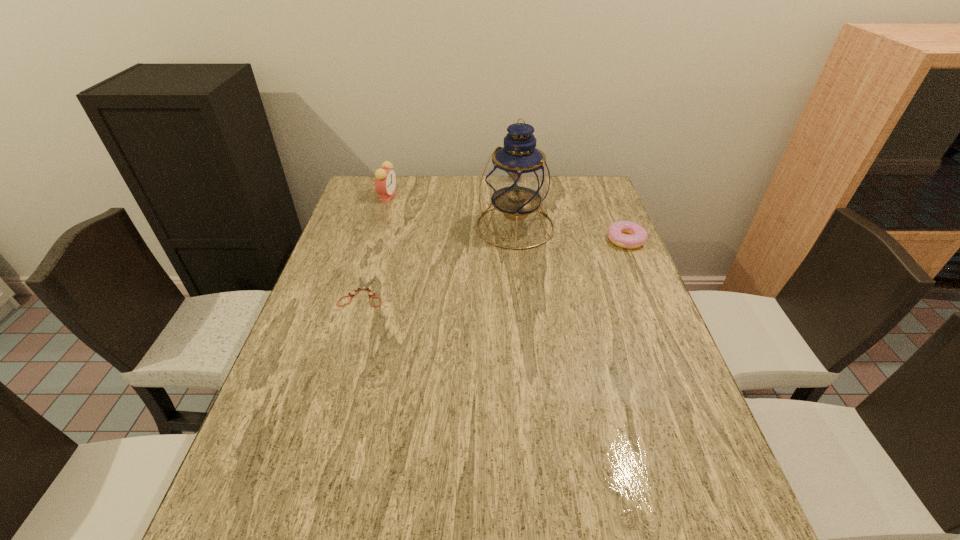
You are a GUI agent. You are given a task and a screenshot of the screen. Output one action in this format:
    pyautogui.click(x=<x>, y=<y>)
    Task: Click on the free space located on the front-facing side of the third object from left to right
    
    Given the screenshot: What is the action you would take?
    pyautogui.click(x=433, y=307)

I want to click on free space located on the front-facing side of the third object from left to right, so click(435, 305).

Find the location of a particular element. The width and height of the screenshot is (960, 540). vacant space located on the front-facing side of the third object from left to right is located at coordinates (428, 312).

I want to click on free space located on the face of the alarm clock, so click(x=432, y=239).

The height and width of the screenshot is (540, 960). What are the coordinates of `vacant region located 0.090m on the face of the alarm clock` in the screenshot? It's located at (404, 213).

At what (x,y) coordinates should I click in order to perform the action: click on vacant space located 0.210m on the face of the alarm clock. Please return your answer as a coordinate pair (x, y). The image size is (960, 540). Looking at the image, I should click on (422, 230).

Find the location of `lantern that is at the far edge`. lantern that is at the far edge is located at coordinates (518, 178).

The width and height of the screenshot is (960, 540). Identify the location of alarm clock located in the far edge section of the desktop. (385, 178).

This screenshot has width=960, height=540. What are the coordinates of `shears that is at the left edge` in the screenshot? It's located at (363, 287).

Identify the location of alarm clock at the left edge. 385,178.